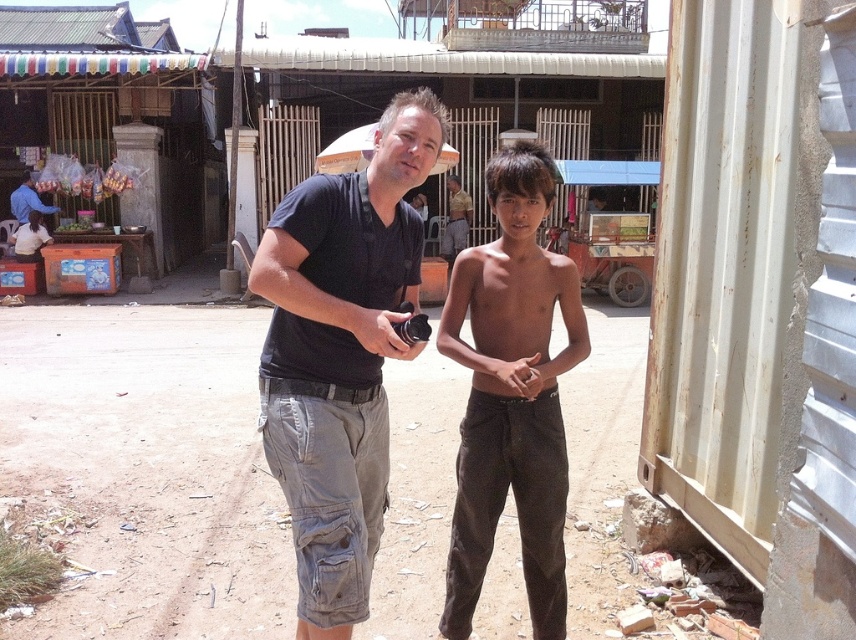
Does black cotton t-shirt at center come behind light brown cotton shirt at center?

That is False.

This screenshot has width=856, height=640. Identify the location of black cotton t-shirt at center. (339, 355).

Where is `black cotton t-shirt at center`? black cotton t-shirt at center is located at coordinates (339, 355).

Is point (449, 205) positioned behind point (528, 371)?

Yes.

Describe the element at coordinates (455, 220) in the screenshot. Image resolution: width=856 pixels, height=640 pixels. I see `light brown cotton shirt at center` at that location.

Where is `light brown cotton shirt at center`? This screenshot has width=856, height=640. light brown cotton shirt at center is located at coordinates (455, 220).

Who is positioned more to the right, matte black camera at center or light brown cotton shirt at center?

light brown cotton shirt at center

Which is behind, point (408, 349) or point (459, 209)?

The point (459, 209) is behind.

Image resolution: width=856 pixels, height=640 pixels. I want to click on matte black camera at center, so click(x=379, y=332).